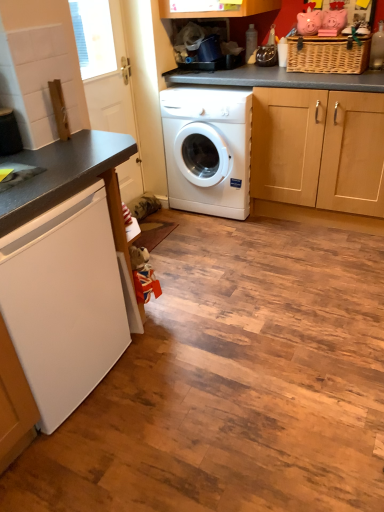
Question: Which direction should I rotate to face white glossy washing machine at center, which ranks as the 2th washing machine in bottom-to-top order, — up or down?

Choices:
 (A) down
 (B) up

Answer: (B)

Question: Can you confirm if woven brown basket at upper right is shorter than white matte refrigerator at lower left, positioned as the 2th washing machine in top-to-bottom order?

Choices:
 (A) yes
 (B) no

Answer: (A)

Question: From the image's perspective, would you say woven brown basket at upper right is shown under white matte refrigerator at lower left, acting as the first washing machine starting from the left?

Choices:
 (A) yes
 (B) no

Answer: (B)

Question: Considering the relative sizes of woven brown basket at upper right and white matte refrigerator at lower left, acting as the first washing machine starting from the left, in the image provided, is woven brown basket at upper right smaller than white matte refrigerator at lower left, acting as the first washing machine starting from the left,?

Choices:
 (A) yes
 (B) no

Answer: (A)

Question: Are woven brown basket at upper right and white matte refrigerator at lower left, arranged as the first washing machine when ordered from the bottom, beside each other?

Choices:
 (A) no
 (B) yes

Answer: (A)

Question: From the image's perspective, is woven brown basket at upper right above white matte refrigerator at lower left, arranged as the first washing machine when ordered from the bottom?

Choices:
 (A) no
 (B) yes

Answer: (B)

Question: Does woven brown basket at upper right have a greater width compared to white matte refrigerator at lower left, which is counted as the second washing machine, starting from the back?

Choices:
 (A) yes
 (B) no

Answer: (B)

Question: Is white matte refrigerator at lower left, arranged as the first washing machine when ordered from the bottom, touching white glossy door at upper left?

Choices:
 (A) yes
 (B) no

Answer: (B)

Question: Does white matte refrigerator at lower left, arranged as the first washing machine when ordered from the bottom, have a lesser height compared to white glossy door at upper left?

Choices:
 (A) yes
 (B) no

Answer: (A)

Question: Is white matte refrigerator at lower left, the second washing machine viewed from the right, to the right of white glossy door at upper left from the viewer's perspective?

Choices:
 (A) no
 (B) yes

Answer: (A)

Question: Is white matte refrigerator at lower left, acting as the first washing machine starting from the left, far away from white glossy door at upper left?

Choices:
 (A) no
 (B) yes

Answer: (B)

Question: Is white matte refrigerator at lower left, arranged as the first washing machine when ordered from the bottom, smaller than white glossy door at upper left?

Choices:
 (A) no
 (B) yes

Answer: (A)

Question: From a real-world perspective, is white matte refrigerator at lower left, acting as the 1th washing machine starting from the front, beneath white glossy door at upper left?

Choices:
 (A) no
 (B) yes

Answer: (B)

Question: Can you confirm if white glossy washing machine at center, arranged as the second washing machine when viewed from the left, is positioned to the left of white matte refrigerator at lower left, the second washing machine viewed from the right?

Choices:
 (A) no
 (B) yes

Answer: (A)